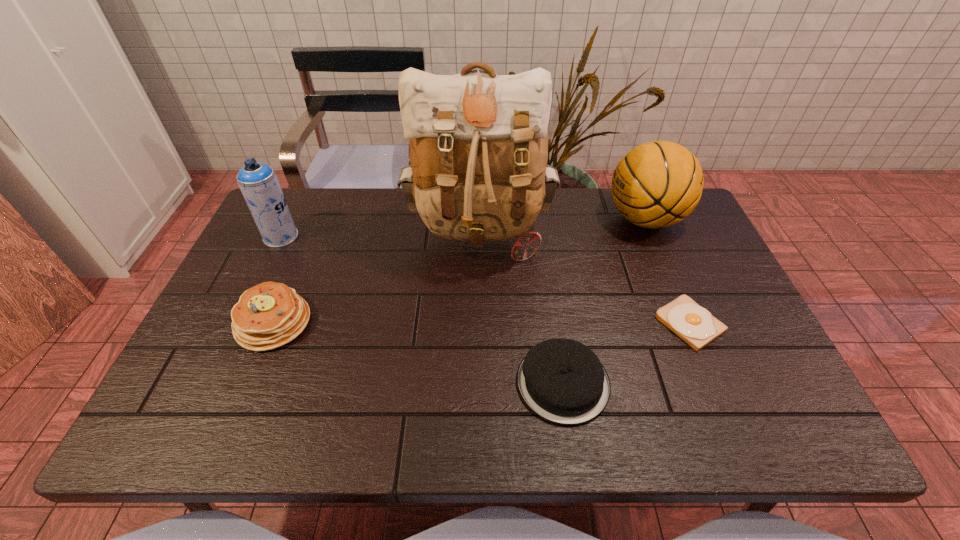
Where is `aerosol can situated at the left edge`? aerosol can situated at the left edge is located at coordinates (258, 182).

You are a GUI agent. You are given a task and a screenshot of the screen. Output one action in this format:
    pyautogui.click(x=<x>, y=<y>)
    Task: Click on the pancake at the left edge
    
    Given the screenshot: What is the action you would take?
    pyautogui.click(x=269, y=315)

Where is `basketball at the right edge`? basketball at the right edge is located at coordinates (657, 184).

Find the location of a particular element. toast located in the right edge section of the desktop is located at coordinates (694, 324).

The width and height of the screenshot is (960, 540). I want to click on object that is positioned at the far left corner, so click(258, 182).

The height and width of the screenshot is (540, 960). What are the coordinates of `object situated at the far right corner` in the screenshot? It's located at (657, 184).

Locate an element on the screen. Image resolution: width=960 pixels, height=540 pixels. vacant space at the far edge is located at coordinates (567, 195).

At what (x,y) coordinates should I click in order to perform the action: click on vacant space at the near edge of the desktop. Please return your answer as a coordinate pair (x, y). This screenshot has height=540, width=960. Looking at the image, I should click on (447, 416).

You are a GUI agent. You are given a task and a screenshot of the screen. Output one action in this format:
    pyautogui.click(x=<x>, y=<y>)
    Task: Click on the vacant space at the left edge of the desktop
    Image resolution: width=960 pixels, height=540 pixels.
    Given the screenshot: What is the action you would take?
    pyautogui.click(x=272, y=248)

At what (x,y) coordinates should I click in order to perform the action: click on vacant space at the right edge of the desktop. Please return your answer as a coordinate pair (x, y). Image resolution: width=960 pixels, height=540 pixels. Looking at the image, I should click on (692, 264).